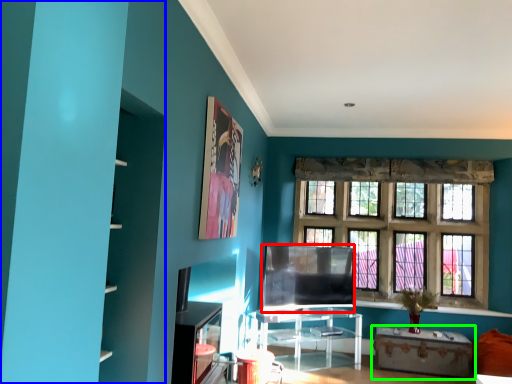
Question: Based on their relative distances, which object is nearer to window screen (highlighted by a red box)? Choose from bookshelf (highlighted by a blue box) and table (highlighted by a green box).

Choices:
 (A) bookshelf
 (B) table

Answer: (B)